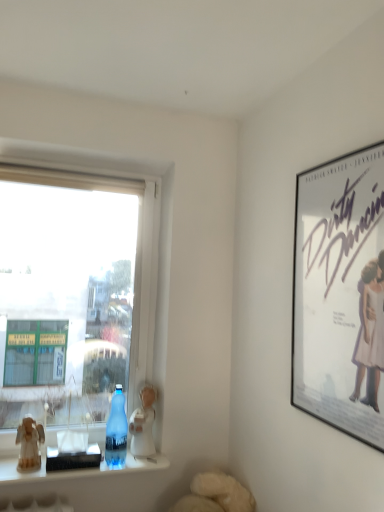
Identify the location of empty space that is ontop of white matte poster at upper right (from a real-world perspective). The image size is (384, 512). (344, 146).